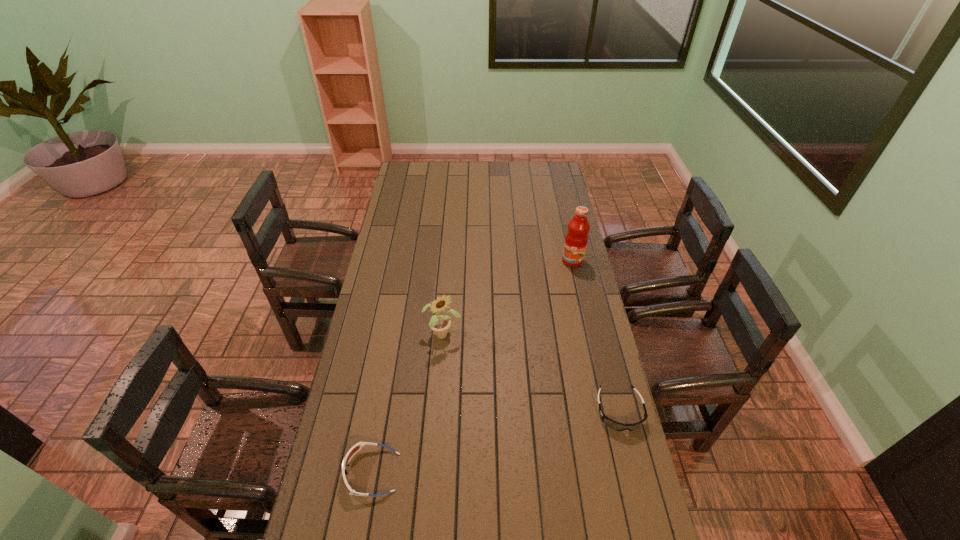
The image size is (960, 540). What are the coordinates of `the taller goggles` in the screenshot? It's located at (356, 447).

Identify the location of the leftmost object. Image resolution: width=960 pixels, height=540 pixels. (356, 447).

Where is `the shorter goggles`? Image resolution: width=960 pixels, height=540 pixels. the shorter goggles is located at coordinates (617, 426).

This screenshot has width=960, height=540. In order to click on the second nearest object in this screenshot , I will do `click(617, 426)`.

Identify the location of the farthest object. This screenshot has height=540, width=960. (576, 239).

What are the coordinates of `fruit juice` in the screenshot? It's located at (576, 239).

The image size is (960, 540). Identify the location of the second tallest object. (440, 324).

The width and height of the screenshot is (960, 540). In order to click on the second farthest object in this screenshot , I will do `click(440, 324)`.

Locate an element on the screen. The image size is (960, 540). vacant position located 0.280m on the front and sides of the farther goggles is located at coordinates (650, 534).

Where is `vacant space located 0.110m on the front label of the tallest object`? The width and height of the screenshot is (960, 540). vacant space located 0.110m on the front label of the tallest object is located at coordinates (563, 284).